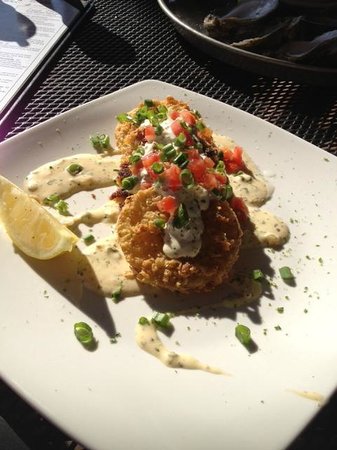
The image size is (337, 450). In order to click on white ceramic plate in this screenshot , I will do `click(210, 428)`.